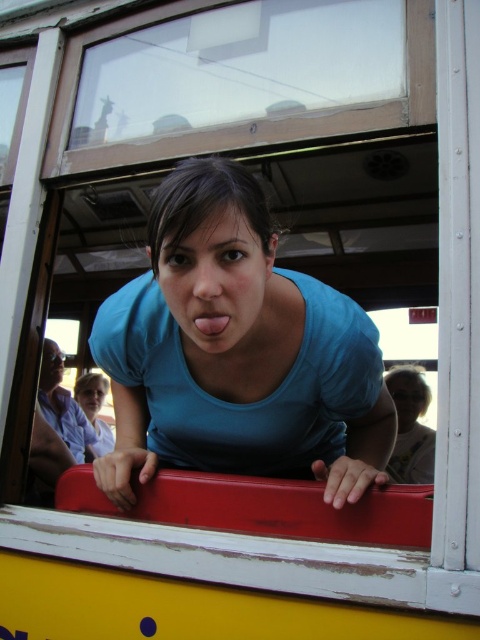
Does point (424, 435) come closer to viewer compared to point (217, 317)?

No.

Can you confirm if matte blue shirt at center is positioned to the left of pink glossy tongue at center?

Incorrect, matte blue shirt at center is not on the left side of pink glossy tongue at center.

What do you see at coordinates (410, 428) in the screenshot?
I see `matte blue shirt at center` at bounding box center [410, 428].

The height and width of the screenshot is (640, 480). In order to click on matte blue shirt at center in this screenshot , I will do `click(410, 428)`.

Is blue matte shirt at center wider than pink glossy tongue at center?

Yes, blue matte shirt at center is wider than pink glossy tongue at center.

Which is more to the left, blue matte shirt at center or pink glossy tongue at center?

pink glossy tongue at center is more to the left.

The height and width of the screenshot is (640, 480). What do you see at coordinates (237, 352) in the screenshot?
I see `blue matte shirt at center` at bounding box center [237, 352].

Where is `blue matte shirt at center`? The width and height of the screenshot is (480, 640). blue matte shirt at center is located at coordinates (237, 352).

Can you confirm if blue matte shirt at center is positioned to the right of matte blue shirt at center?

Incorrect, blue matte shirt at center is not on the right side of matte blue shirt at center.

Identify the location of blue matte shirt at center. (237, 352).

I want to click on blue matte shirt at center, so coord(237,352).

Where is `blue matte shirt at center`? This screenshot has width=480, height=640. blue matte shirt at center is located at coordinates (x=237, y=352).